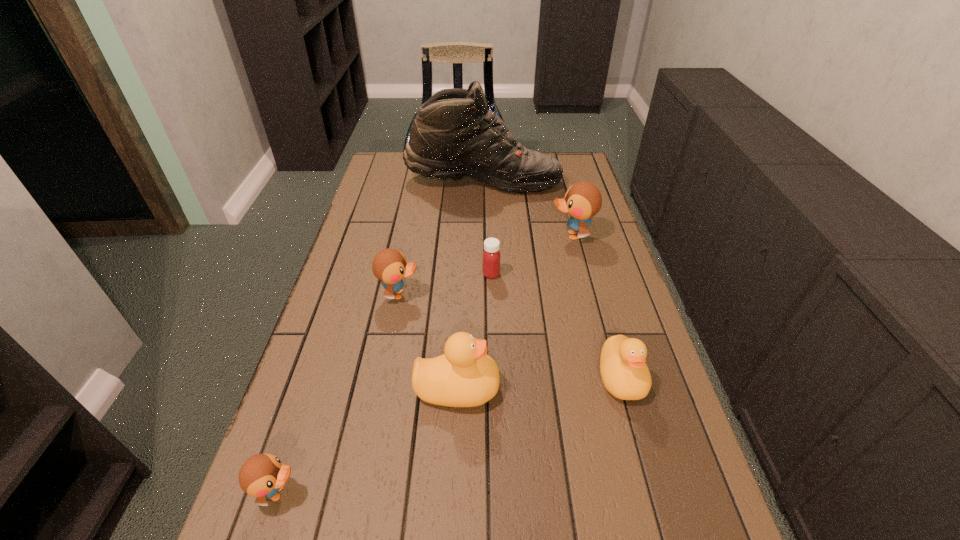
Locate an element on the screen. The height and width of the screenshot is (540, 960). vacant space located 0.090m on the back of the medicine is located at coordinates (491, 249).

Image resolution: width=960 pixels, height=540 pixels. I want to click on vacant area situated on the front-facing side of the leftmost duck, so click(508, 492).

This screenshot has width=960, height=540. Identify the location of object present at the far edge. (454, 135).

Locate an element on the screen. The image size is (960, 540). ski boot that is at the left edge is located at coordinates (454, 135).

This screenshot has width=960, height=540. Find the location of `ski boot positioned at the right edge`. ski boot positioned at the right edge is located at coordinates (454, 135).

I want to click on object located in the far left corner section of the desktop, so click(x=454, y=135).

Locate an element on the screen. The image size is (960, 540). object at the far right corner is located at coordinates (454, 135).

Find the location of `blank area at the left edge`. blank area at the left edge is located at coordinates (343, 339).

This screenshot has width=960, height=540. In the image, there is a desktop. What are the coordinates of `vacant space at the right edge` in the screenshot? It's located at (598, 281).

At what (x,y) coordinates should I click in order to perform the action: click on free space at the far left corner of the desktop. Please return your answer as a coordinate pair (x, y). The height and width of the screenshot is (540, 960). Looking at the image, I should click on (379, 183).